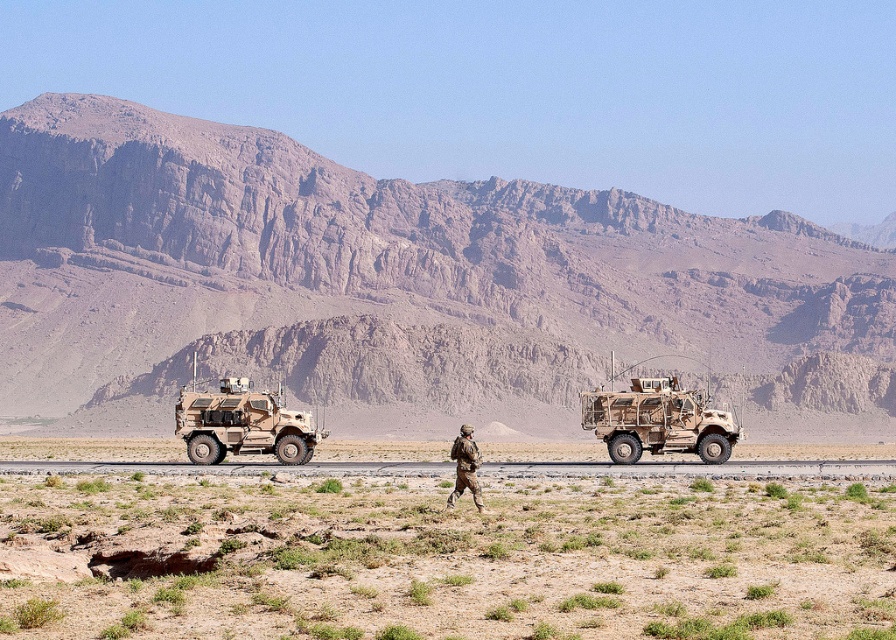
Is camouflage fabric vehicle at center below camouflage fabric armored vehicle at center?

Incorrect, camouflage fabric vehicle at center is not positioned below camouflage fabric armored vehicle at center.

Is camouflage fabric vehicle at center shorter than camouflage fabric armored vehicle at center?

Indeed, camouflage fabric vehicle at center has a lesser height compared to camouflage fabric armored vehicle at center.

Describe the element at coordinates (658, 420) in the screenshot. I see `camouflage fabric vehicle at center` at that location.

This screenshot has height=640, width=896. Find the location of `camouflage fabric vehicle at center`. camouflage fabric vehicle at center is located at coordinates (658, 420).

Is point (229, 417) positioned in front of point (470, 426)?

Yes.

Does camouflage fabric armored vehicle at center come behind camouflage fabric uniform at center?

Yes, it is behind camouflage fabric uniform at center.

In order to click on camouflage fabric armored vehicle at center in this screenshot , I will do `click(242, 424)`.

Is point (831, 372) in front of point (192, 410)?

No, (831, 372) is behind (192, 410).

Does brown rocky mountain at upper center come behind camouflage fabric armored vehicle at center?

That is True.

At what (x,y) coordinates should I click in order to perform the action: click on brown rocky mountain at upper center. Please return your answer as a coordinate pair (x, y). Image resolution: width=896 pixels, height=640 pixels. Looking at the image, I should click on (401, 289).